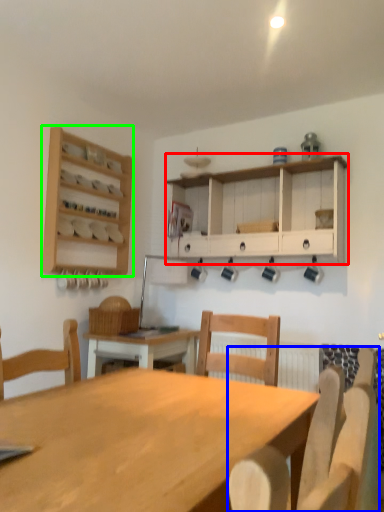
Question: Which is nearer to the cabinetry (highlighted by a red box)? chair (highlighted by a blue box) or shelf (highlighted by a green box).

Choices:
 (A) chair
 (B) shelf

Answer: (B)